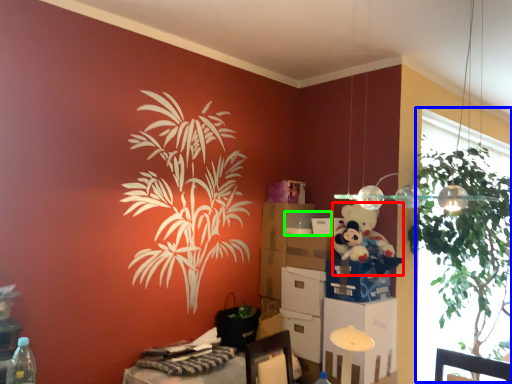
Question: Based on their relative distances, which object is farther from teddy bear (highlighted by a red box)? Choose from window screen (highlighted by a blue box) and box (highlighted by a green box).

Choices:
 (A) window screen
 (B) box

Answer: (A)